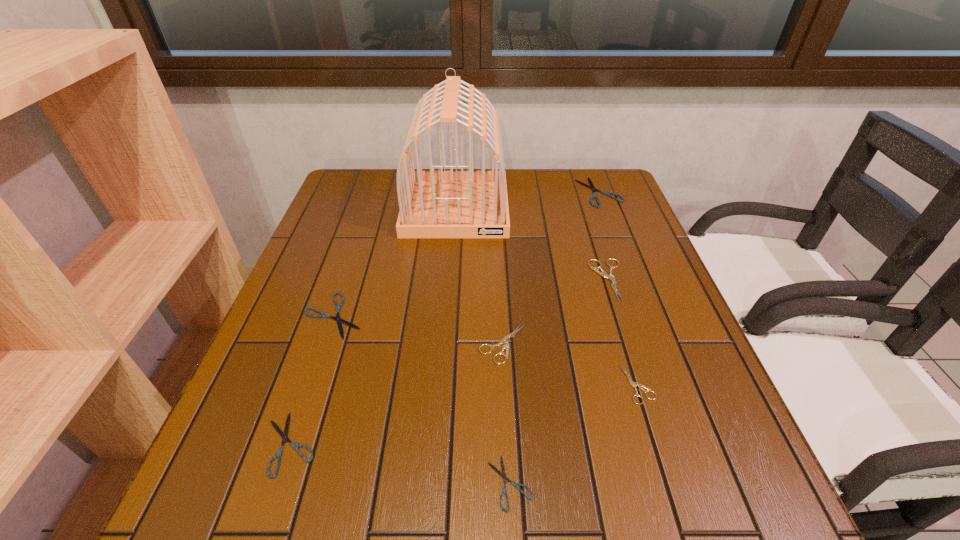
Identify the location of free point that satisfies the following two spatial constraints: 1. with an open door on the second farthest beige shears; 2. on the right side of the tallest object. Image resolution: width=960 pixels, height=540 pixels. (445, 344).

Find the location of a particular element. vacant region that satisfies the following two spatial constraints: 1. on the back side of the biggest black shears; 2. on the left side of the second biggest black shears is located at coordinates (375, 192).

At what (x,y) coordinates should I click in order to perform the action: click on vacant point that satisfies the following two spatial constraints: 1. on the front side of the second biggest beige shears; 2. on the right side of the smallest black shears. Please return your answer as a coordinate pair (x, y). The image size is (960, 540). Looking at the image, I should click on (x=510, y=483).

Locate an element on the screen. free location that satisfies the following two spatial constraints: 1. with an open door on the farthest beige shears; 2. on the right side of the tallest object is located at coordinates (450, 280).

This screenshot has width=960, height=540. I want to click on free space that satisfies the following two spatial constraints: 1. with an open door on the beige birdcage; 2. on the left side of the leftmost beige shears, so click(x=445, y=344).

Locate an element on the screen. Image resolution: width=960 pixels, height=540 pixels. free point that satisfies the following two spatial constraints: 1. on the front side of the third nearest object; 2. on the right side of the third smallest black shears is located at coordinates (311, 384).